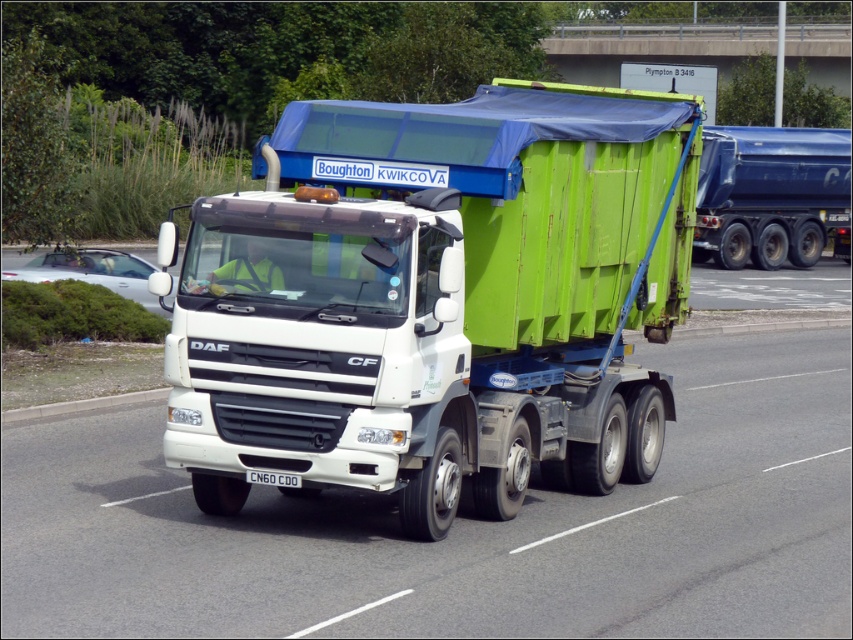
Between green matte trailer truck at center and blue metallic trailer at right, which one is positioned lower?

Positioned lower is green matte trailer truck at center.

Is point (276, 401) farther from viewer compared to point (701, 168)?

That is False.

Does point (170, 348) come in front of point (788, 129)?

Yes, it is.

Locate an element on the screen. Image resolution: width=853 pixels, height=640 pixels. green matte trailer truck at center is located at coordinates (437, 300).

From the picture: Who is positioned more to the left, blue metallic trailer at right or white plastic license plate at center?

Positioned to the left is white plastic license plate at center.

Looking at this image, who is taller, blue metallic trailer at right or white plastic license plate at center?

blue metallic trailer at right

At what (x,y) coordinates should I click in order to perform the action: click on blue metallic trailer at right. Please return your answer as a coordinate pair (x, y). The height and width of the screenshot is (640, 853). Looking at the image, I should click on (769, 193).

Is green matte trailer truck at center taller than white plastic license plate at center?

Yes.

Can you confirm if green matte trailer truck at center is smaller than white plastic license plate at center?

Actually, green matte trailer truck at center might be larger than white plastic license plate at center.

What do you see at coordinates (437, 300) in the screenshot? I see `green matte trailer truck at center` at bounding box center [437, 300].

Where is `green matte trailer truck at center`? green matte trailer truck at center is located at coordinates (437, 300).